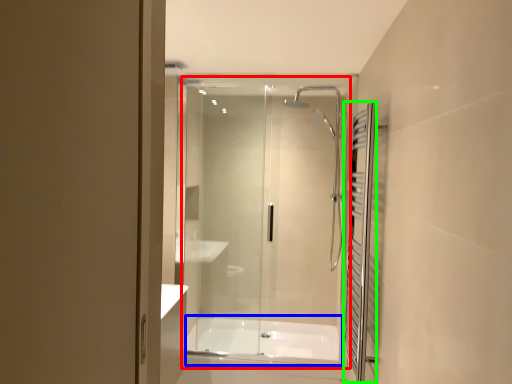
Question: Which object is positioned closest to glass door (highlighted by a red box)? Select from bath (highlighted by a blue box) and shower curtain (highlighted by a green box).

Choices:
 (A) bath
 (B) shower curtain

Answer: (A)